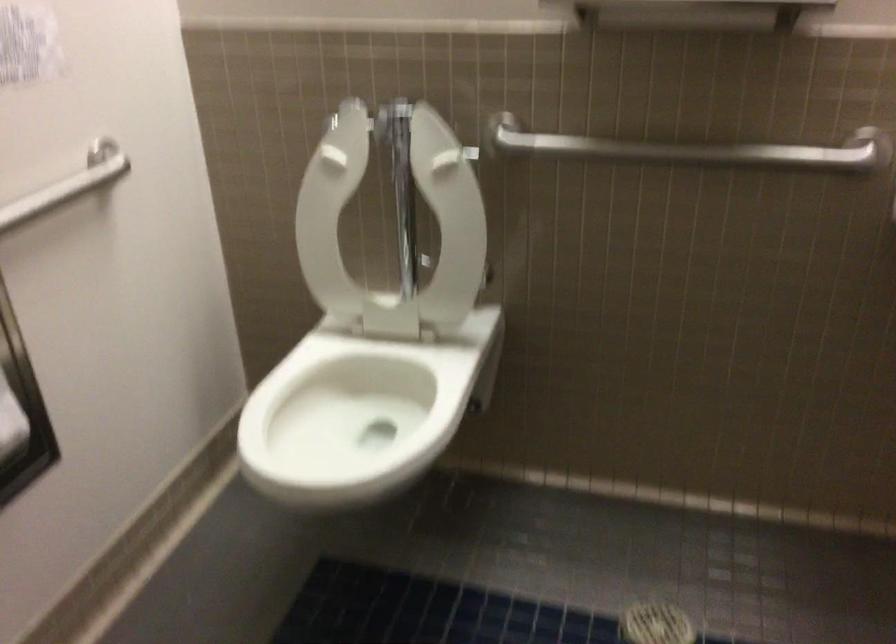
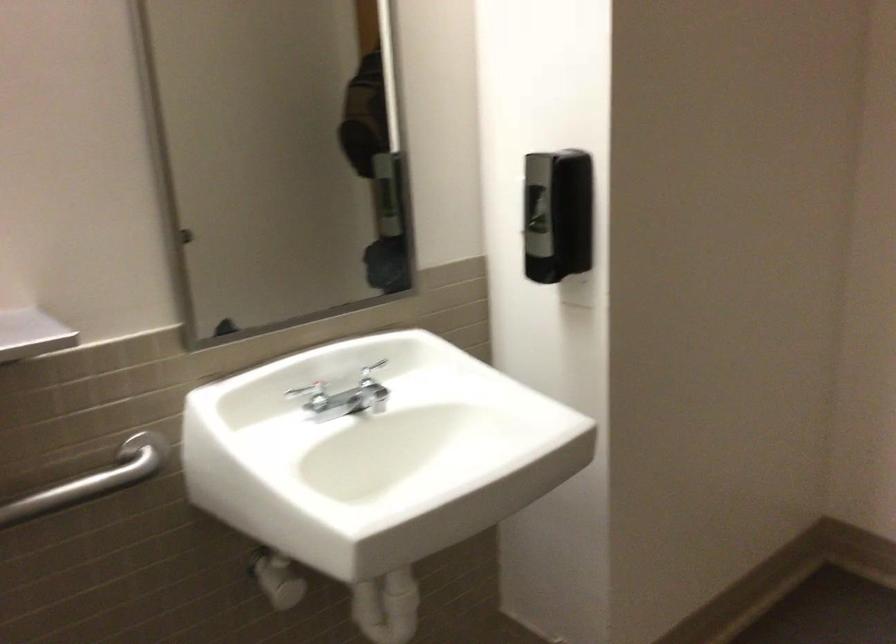
Question: How did the camera likely rotate?

Choices:
 (A) Left
 (B) Right
 (C) Up
 (D) Down

Answer: (B)